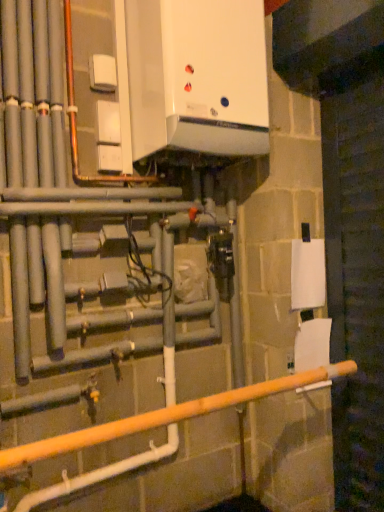
The image size is (384, 512). What do you see at coordinates (312, 344) in the screenshot?
I see `white matte toilet paper at lower right, the first toilet paper from the bottom` at bounding box center [312, 344].

This screenshot has height=512, width=384. In order to click on white glossy boiler at upper center in this screenshot , I will do `click(197, 76)`.

Is white matte toilet paper at lower right, which is counted as the 2th toilet paper, starting from the top, bigger than wooden pole at lower center?

No.

Is wooden pole at lower center completely or partially inside white matte toilet paper at lower right, which is counted as the 2th toilet paper, starting from the top?

No, white matte toilet paper at lower right, which is counted as the 2th toilet paper, starting from the top, does not contain wooden pole at lower center.

Considering the positions of objects white matte toilet paper at lower right, which is counted as the 2th toilet paper, starting from the top, and wooden pole at lower center in the image provided, who is in front, white matte toilet paper at lower right, which is counted as the 2th toilet paper, starting from the top, or wooden pole at lower center?

wooden pole at lower center is closer to the camera.

From the picture: From the image's perspective, which object appears higher, white matte toilet paper at lower right, which is counted as the 2th toilet paper, starting from the top, or wooden pole at lower center?

From the image's view, white matte toilet paper at lower right, which is counted as the 2th toilet paper, starting from the top, is above.

Where is `rail below the white matte toilet paper at right, which appears as the first toilet paper when viewed from the top (from the image's perspective)`? The height and width of the screenshot is (512, 384). rail below the white matte toilet paper at right, which appears as the first toilet paper when viewed from the top (from the image's perspective) is located at coordinates (166, 416).

Is wooden pole at lower center shorter than white matte toilet paper at right, which is the second toilet paper from bottom to top?

Result: Yes.

Which of these two, wooden pole at lower center or white matte toilet paper at right, which is the second toilet paper from bottom to top, is smaller?

With smaller size is white matte toilet paper at right, which is the second toilet paper from bottom to top.

Is wooden pole at lower center beside white matte toilet paper at right, which appears as the first toilet paper when viewed from the top?

No, wooden pole at lower center is not beside white matte toilet paper at right, which appears as the first toilet paper when viewed from the top.

Which of these two, white matte toilet paper at lower right, which is counted as the 2th toilet paper, starting from the top, or white glossy boiler at upper center, stands taller?

With more height is white glossy boiler at upper center.

From the image's perspective, which is below, white matte toilet paper at lower right, the first toilet paper from the bottom, or white glossy boiler at upper center?

From the image's view, white matte toilet paper at lower right, the first toilet paper from the bottom, is below.

Is white matte toilet paper at lower right, the first toilet paper from the bottom, wider or thinner than white glossy boiler at upper center?

Considering their sizes, white matte toilet paper at lower right, the first toilet paper from the bottom, looks slimmer than white glossy boiler at upper center.

Which object is closer to the camera taking this photo, white matte toilet paper at lower right, which is counted as the 2th toilet paper, starting from the top, or white glossy boiler at upper center?

white glossy boiler at upper center is more forward.

Looking at this image, how distant is white matte toilet paper at lower right, the first toilet paper from the bottom, from white matte toilet paper at right, which is the second toilet paper from bottom to top?

7.55 inches.

From the image's perspective, is white matte toilet paper at lower right, which is counted as the 2th toilet paper, starting from the top, positioned above or below white matte toilet paper at right, which is the second toilet paper from bottom to top?

Based on their image positions, white matte toilet paper at lower right, which is counted as the 2th toilet paper, starting from the top, is located beneath white matte toilet paper at right, which is the second toilet paper from bottom to top.

Considering the sizes of white matte toilet paper at lower right, the first toilet paper from the bottom, and white matte toilet paper at right, which appears as the first toilet paper when viewed from the top, in the image, is white matte toilet paper at lower right, the first toilet paper from the bottom, taller or shorter than white matte toilet paper at right, which appears as the first toilet paper when viewed from the top,?

In the image, white matte toilet paper at lower right, the first toilet paper from the bottom, appears to be shorter than white matte toilet paper at right, which appears as the first toilet paper when viewed from the top.

Between white matte toilet paper at lower right, which is counted as the 2th toilet paper, starting from the top, and white matte toilet paper at right, which is the second toilet paper from bottom to top, which one is positioned in front?

white matte toilet paper at lower right, which is counted as the 2th toilet paper, starting from the top.

From the image's perspective, which one is positioned higher, white glossy boiler at upper center or wooden pole at lower center?

From the image's view, white glossy boiler at upper center is above.

Can you confirm if white glossy boiler at upper center is positioned to the left of wooden pole at lower center?

Correct, you'll find white glossy boiler at upper center to the left of wooden pole at lower center.

Is white glossy boiler at upper center located outside wooden pole at lower center?

Indeed, white glossy boiler at upper center is completely outside wooden pole at lower center.

Where is `home appliance above the wooden pole at lower center (from a real-world perspective)`? Image resolution: width=384 pixels, height=512 pixels. home appliance above the wooden pole at lower center (from a real-world perspective) is located at coordinates (197, 76).

Considering the relative positions of white glossy boiler at upper center and white matte toilet paper at right, which appears as the first toilet paper when viewed from the top, in the image provided, is white glossy boiler at upper center to the left of white matte toilet paper at right, which appears as the first toilet paper when viewed from the top, from the viewer's perspective?

Indeed, white glossy boiler at upper center is positioned on the left side of white matte toilet paper at right, which appears as the first toilet paper when viewed from the top.

Considering the sizes of objects white glossy boiler at upper center and white matte toilet paper at right, which appears as the first toilet paper when viewed from the top, in the image provided, who is taller, white glossy boiler at upper center or white matte toilet paper at right, which appears as the first toilet paper when viewed from the top,?

white glossy boiler at upper center is taller.

Is white glossy boiler at upper center smaller than white matte toilet paper at right, which is the second toilet paper from bottom to top?

No, white glossy boiler at upper center is not smaller than white matte toilet paper at right, which is the second toilet paper from bottom to top.

Would you say white glossy boiler at upper center is inside or outside white matte toilet paper at right, which is the second toilet paper from bottom to top?

white glossy boiler at upper center lies outside white matte toilet paper at right, which is the second toilet paper from bottom to top.

Is white matte toilet paper at right, which appears as the first toilet paper when viewed from the top, facing away from white matte toilet paper at lower right, which is counted as the 2th toilet paper, starting from the top?

white matte toilet paper at right, which appears as the first toilet paper when viewed from the top, is not turned away from white matte toilet paper at lower right, which is counted as the 2th toilet paper, starting from the top.

You are a GUI agent. You are given a task and a screenshot of the screen. Output one action in this format:
    pyautogui.click(x=<x>, y=<y>)
    Task: Click on the toilet paper on the left side of white matte toilet paper at lower right, the first toilet paper from the bottom
    
    Given the screenshot: What is the action you would take?
    pyautogui.click(x=308, y=274)

Which of these two, white matte toilet paper at right, which appears as the first toilet paper when viewed from the top, or white matte toilet paper at lower right, the first toilet paper from the bottom, is thinner?

With smaller width is white matte toilet paper at right, which appears as the first toilet paper when viewed from the top.

Does white matte toilet paper at right, which appears as the first toilet paper when viewed from the top, come in front of white matte toilet paper at lower right, which is counted as the 2th toilet paper, starting from the top?

No, it is not.

This screenshot has width=384, height=512. I want to click on rail in front of the white matte toilet paper at lower right, which is counted as the 2th toilet paper, starting from the top, so click(x=166, y=416).

This screenshot has width=384, height=512. Find the location of `rail on the left of white matte toilet paper at right, which is the second toilet paper from bottom to top`. rail on the left of white matte toilet paper at right, which is the second toilet paper from bottom to top is located at coordinates (166, 416).

Looking at this image, when comparing their distances from white matte toilet paper at right, which appears as the first toilet paper when viewed from the top, does white matte toilet paper at lower right, the first toilet paper from the bottom, or wooden pole at lower center seem further?

The object further to white matte toilet paper at right, which appears as the first toilet paper when viewed from the top, is wooden pole at lower center.

Based on their spatial positions, is white matte toilet paper at right, which is the second toilet paper from bottom to top, or white matte toilet paper at lower right, the first toilet paper from the bottom, closer to wooden pole at lower center?

Among the two, white matte toilet paper at lower right, the first toilet paper from the bottom, is located nearer to wooden pole at lower center.

Looking at the image, which one is located further to white matte toilet paper at lower right, the first toilet paper from the bottom, wooden pole at lower center or white glossy boiler at upper center?

white glossy boiler at upper center is positioned further to the anchor white matte toilet paper at lower right, the first toilet paper from the bottom.

Based on their spatial positions, is white matte toilet paper at lower right, the first toilet paper from the bottom, or white matte toilet paper at right, which is the second toilet paper from bottom to top, further from white glossy boiler at upper center?

Based on the image, white matte toilet paper at lower right, the first toilet paper from the bottom, appears to be further to white glossy boiler at upper center.

Based on their spatial positions, is white glossy boiler at upper center or white matte toilet paper at lower right, the first toilet paper from the bottom, further from wooden pole at lower center?

The object further to wooden pole at lower center is white glossy boiler at upper center.

Looking at the image, which one is located closer to white matte toilet paper at right, which appears as the first toilet paper when viewed from the top, white matte toilet paper at lower right, which is counted as the 2th toilet paper, starting from the top, or white glossy boiler at upper center?

white matte toilet paper at lower right, which is counted as the 2th toilet paper, starting from the top, is positioned closer to the anchor white matte toilet paper at right, which appears as the first toilet paper when viewed from the top.

Based on their spatial positions, is white matte toilet paper at right, which appears as the first toilet paper when viewed from the top, or white matte toilet paper at lower right, which is counted as the 2th toilet paper, starting from the top, closer to white glossy boiler at upper center?

white matte toilet paper at right, which appears as the first toilet paper when viewed from the top.

From the image, which object appears to be farther from white matte toilet paper at lower right, which is counted as the 2th toilet paper, starting from the top, white matte toilet paper at right, which appears as the first toilet paper when viewed from the top, or wooden pole at lower center?

wooden pole at lower center lies further to white matte toilet paper at lower right, which is counted as the 2th toilet paper, starting from the top, than the other object.

You are a GUI agent. You are given a task and a screenshot of the screen. Output one action in this format:
    pyautogui.click(x=<x>, y=<y>)
    Task: Click on the toilet paper located between wooden pole at lower center and white matte toilet paper at right, which is the second toilet paper from bottom to top, in the depth direction
    The image size is (384, 512).
    Given the screenshot: What is the action you would take?
    pyautogui.click(x=312, y=344)

You are a GUI agent. You are given a task and a screenshot of the screen. Output one action in this format:
    pyautogui.click(x=<x>, y=<y>)
    Task: Click on the toilet paper between white glossy boiler at upper center and white matte toilet paper at lower right, the first toilet paper from the bottom, from top to bottom
    The width and height of the screenshot is (384, 512).
    Given the screenshot: What is the action you would take?
    pyautogui.click(x=308, y=274)